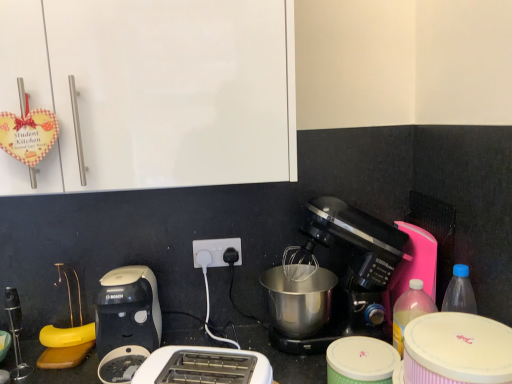
What are the coordinates of `green polka dot container at lower center, placed as the 1th appliance when sorted from bottom to top` in the screenshot? It's located at (360, 361).

What are the coordinates of `white plastic toaster at lower left, which is counted as the second toaster, starting from the right` in the screenshot? It's located at tap(127, 310).

What do you see at coordinates (153, 91) in the screenshot? I see `white glossy cabinet at upper left` at bounding box center [153, 91].

Find the location of a particular element. The image size is (512, 384). white plastic power plugs and sockets at center is located at coordinates (217, 250).

Image resolution: width=512 pixels, height=384 pixels. Describe the element at coordinates (217, 250) in the screenshot. I see `white plastic power plugs and sockets at center` at that location.

Locate an element on the screen. pink plastic bottle at right is located at coordinates (410, 311).

Measure the distance between pink plastic bottle at right and camera.

pink plastic bottle at right is 37.62 inches away from camera.

I want to click on white plastic toaster at lower center, the second toaster viewed from the back, so click(204, 366).

Identify the location of green polka dot container at lower center, arranged as the 2th appliance when viewed from the top. (360, 361).

Based on the photo, considering the relative sizes of pink striped container at lower right, acting as the second appliance starting from the bottom, and pink plastic bottle at right in the image provided, is pink striped container at lower right, acting as the second appliance starting from the bottom, shorter than pink plastic bottle at right?

Yes.

Is pink striped container at lower right, which appears as the first appliance when viewed from the top, looking in the opposite direction of pink plastic bottle at right?

Correct, pink striped container at lower right, which appears as the first appliance when viewed from the top, is looking away from pink plastic bottle at right.

Can you confirm if pink striped container at lower right, acting as the second appliance starting from the bottom, is smaller than pink plastic bottle at right?

Incorrect, pink striped container at lower right, acting as the second appliance starting from the bottom, is not smaller in size than pink plastic bottle at right.

I want to click on bottle behind the pink striped container at lower right, acting as the second appliance starting from the bottom, so (x=410, y=311).

How distant is black plastic coffee maker at center from pink plastic bottle at right?

black plastic coffee maker at center is 7.23 inches from pink plastic bottle at right.

In the scene shown: Are black plastic coffee maker at center and pink plastic bottle at right far apart?

No.

Considering the sizes of objects black plastic coffee maker at center and pink plastic bottle at right in the image provided, who is smaller, black plastic coffee maker at center or pink plastic bottle at right?

pink plastic bottle at right.

Can you confirm if black plastic coffee maker at center is positioned to the right of pink plastic bottle at right?

No.

From a real-world perspective, between pink striped container at lower right, which appears as the first appliance when viewed from the top, and white plastic power plugs and sockets at center, who is vertically higher?

From a 3D spatial view, white plastic power plugs and sockets at center is above.

Is there a large distance between pink striped container at lower right, which appears as the first appliance when viewed from the top, and white plastic power plugs and sockets at center?

No, pink striped container at lower right, which appears as the first appliance when viewed from the top, is in close proximity to white plastic power plugs and sockets at center.

Is pink striped container at lower right, which appears as the first appliance when viewed from the top, situated inside white plastic power plugs and sockets at center or outside?

pink striped container at lower right, which appears as the first appliance when viewed from the top, cannot be found inside white plastic power plugs and sockets at center.

Which object is more forward, green polka dot container at lower center, arranged as the 2th appliance when viewed from the top, or pink plastic bottle at right?

green polka dot container at lower center, arranged as the 2th appliance when viewed from the top, is in front.

Does green polka dot container at lower center, placed as the 1th appliance when sorted from bottom to top, have a greater height compared to pink plastic bottle at right?

No.

Which of these two, green polka dot container at lower center, placed as the 1th appliance when sorted from bottom to top, or pink plastic bottle at right, is smaller?

With smaller size is pink plastic bottle at right.

You are a GUI agent. You are given a task and a screenshot of the screen. Output one action in this format:
    pyautogui.click(x=<x>, y=<y>)
    Task: Click on the power plugs and sockets behind the white plastic toaster at lower center, which is the first toaster in front-to-back order
    This screenshot has height=384, width=512.
    Given the screenshot: What is the action you would take?
    pyautogui.click(x=217, y=250)

Which object is positioned more to the left, white plastic power plugs and sockets at center or white plastic toaster at lower center, marked as the 1th toaster in a right-to-left arrangement?

white plastic power plugs and sockets at center.

Could you tell me if white plastic power plugs and sockets at center is facing white plastic toaster at lower center, marked as the 1th toaster in a right-to-left arrangement?

Yes, white plastic power plugs and sockets at center is aimed at white plastic toaster at lower center, marked as the 1th toaster in a right-to-left arrangement.

From a real-world perspective, which is physically above, white plastic power plugs and sockets at center or white plastic toaster at lower center, the 2th toaster positioned from the left?

From a 3D spatial view, white plastic power plugs and sockets at center is above.

Is black plastic coffee maker at center next to white plastic toaster at lower left, the first toaster positioned from the back?

There is a gap between black plastic coffee maker at center and white plastic toaster at lower left, the first toaster positioned from the back.

Considering the positions of point (387, 340) and point (152, 311), is point (387, 340) closer or farther from the camera than point (152, 311)?

Point (387, 340) appears to be closer to the viewer than point (152, 311).

Is white plastic toaster at lower left, which is counted as the second toaster, starting from the right, oriented towards white glossy cabinet at upper left?

No, white plastic toaster at lower left, which is counted as the second toaster, starting from the right, does not turn towards white glossy cabinet at upper left.

Would you say white plastic toaster at lower left, which ranks as the first toaster in left-to-right order, is to the left or to the right of white glossy cabinet at upper left in the picture?

white plastic toaster at lower left, which ranks as the first toaster in left-to-right order, is to the left of white glossy cabinet at upper left.

Does white plastic toaster at lower left, which ranks as the first toaster in left-to-right order, have a larger size compared to white glossy cabinet at upper left?

No.

Is white plastic toaster at lower left, acting as the second toaster starting from the front, spatially inside white glossy cabinet at upper left, or outside of it?

white plastic toaster at lower left, acting as the second toaster starting from the front, exists outside the volume of white glossy cabinet at upper left.

At what (x,y) coordinates should I click in order to perform the action: click on the 2nd appliance in front of the pink plastic bottle at right. Please return your answer as a coordinate pair (x, y). The width and height of the screenshot is (512, 384). Looking at the image, I should click on (457, 349).

The height and width of the screenshot is (384, 512). What are the coordinates of `bottle lying on the right of black plastic coffee maker at center` in the screenshot? It's located at (410, 311).

When comparing their distances from pink striped container at lower right, acting as the second appliance starting from the bottom, does green polka dot container at lower center, arranged as the 2th appliance when viewed from the top, or white plastic power plugs and sockets at center seem further?

white plastic power plugs and sockets at center lies further to pink striped container at lower right, acting as the second appliance starting from the bottom, than the other object.

Based on their spatial positions, is white plastic toaster at lower center, marked as the 1th toaster in a right-to-left arrangement, or white plastic power plugs and sockets at center further from white glossy cabinet at upper left?

white plastic power plugs and sockets at center.

Looking at the image, which one is located closer to black plastic coffee maker at center, green polka dot container at lower center, placed as the 1th appliance when sorted from bottom to top, or white glossy cabinet at upper left?

Based on the image, green polka dot container at lower center, placed as the 1th appliance when sorted from bottom to top, appears to be nearer to black plastic coffee maker at center.

From the image, which object appears to be farther from white plastic toaster at lower left, which ranks as the first toaster in left-to-right order, white plastic power plugs and sockets at center or pink plastic bottle at right?

pink plastic bottle at right is positioned further to the anchor white plastic toaster at lower left, which ranks as the first toaster in left-to-right order.

Estimate the real-world distances between objects in this image. Which object is further from green polka dot container at lower center, placed as the 1th appliance when sorted from bottom to top, black plastic coffee maker at center or pink striped container at lower right, acting as the second appliance starting from the bottom?

black plastic coffee maker at center lies further to green polka dot container at lower center, placed as the 1th appliance when sorted from bottom to top, than the other object.

Looking at the image, which one is located further to white plastic power plugs and sockets at center, green polka dot container at lower center, placed as the 1th appliance when sorted from bottom to top, or white plastic toaster at lower left, which is counted as the second toaster, starting from the right?

green polka dot container at lower center, placed as the 1th appliance when sorted from bottom to top, lies further to white plastic power plugs and sockets at center than the other object.

Looking at the image, which one is located closer to white plastic toaster at lower center, marked as the 1th toaster in a right-to-left arrangement, white plastic toaster at lower left, the first toaster positioned from the back, or white glossy cabinet at upper left?

The object closer to white plastic toaster at lower center, marked as the 1th toaster in a right-to-left arrangement, is white plastic toaster at lower left, the first toaster positioned from the back.

Which object lies further to the anchor point pink plastic bottle at right, black plastic coffee maker at center or white plastic toaster at lower center, the 2th toaster positioned from the left?

white plastic toaster at lower center, the 2th toaster positioned from the left, lies further to pink plastic bottle at right than the other object.

At what (x,y) coordinates should I click in order to perform the action: click on coffee maker positioned between white plastic toaster at lower center, marked as the 1th toaster in a right-to-left arrangement, and white plastic power plugs and sockets at center from near to far. Please return your answer as a coordinate pair (x, y). Looking at the image, I should click on (346, 273).

This screenshot has height=384, width=512. I want to click on coffee maker located between white plastic toaster at lower left, which ranks as the first toaster in left-to-right order, and pink striped container at lower right, acting as the second appliance starting from the bottom, in the left-right direction, so click(346, 273).

The image size is (512, 384). What are the coordinates of `appliance between white plastic toaster at lower left, which ranks as the first toaster in left-to-right order, and pink plastic bottle at right, in the horizontal direction` in the screenshot? It's located at (360, 361).

I want to click on appliance situated between white plastic toaster at lower center, which is the first toaster in front-to-back order, and pink striped container at lower right, which appears as the first appliance when viewed from the top, from left to right, so click(x=360, y=361).